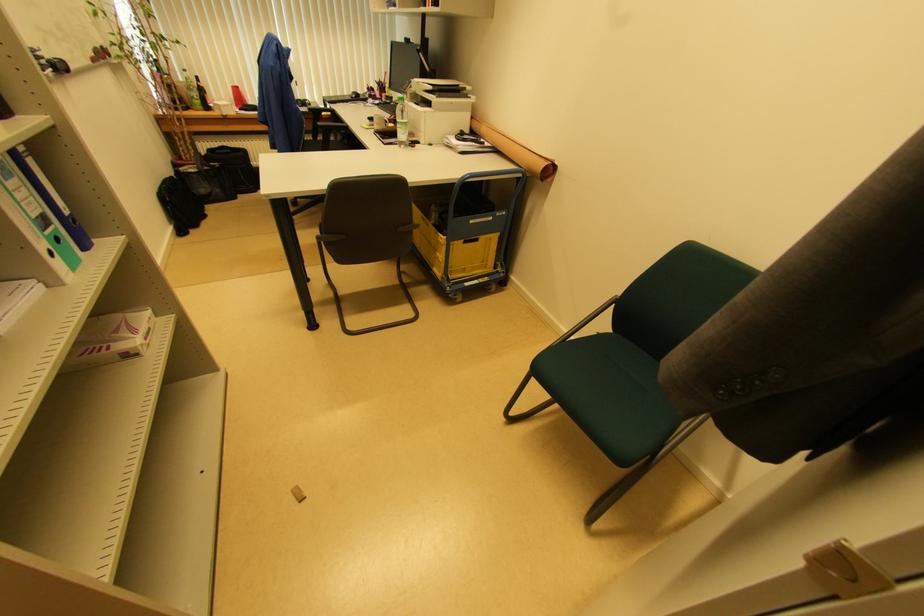
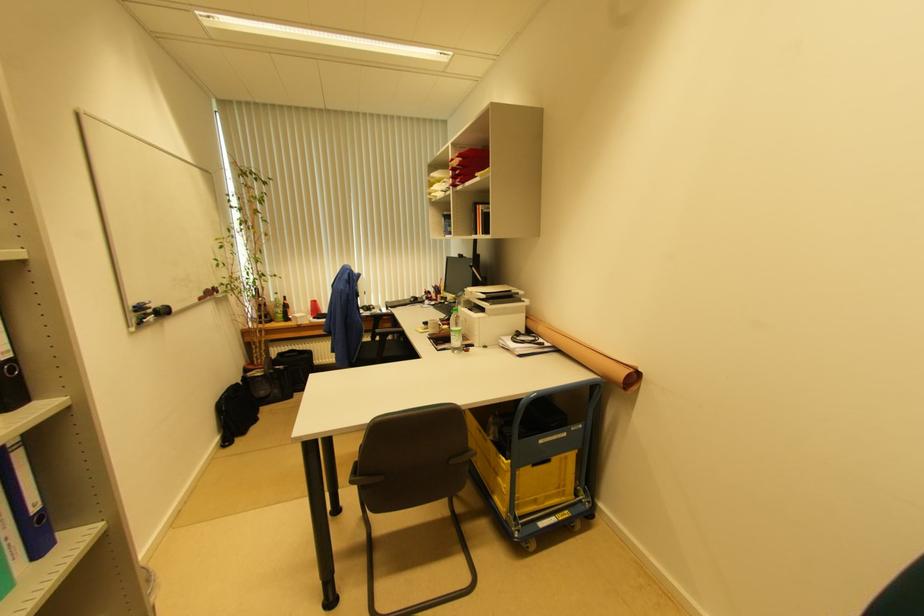
Find the pixel in the second image that matches pixel 438 253 in the first image.

(499, 477)